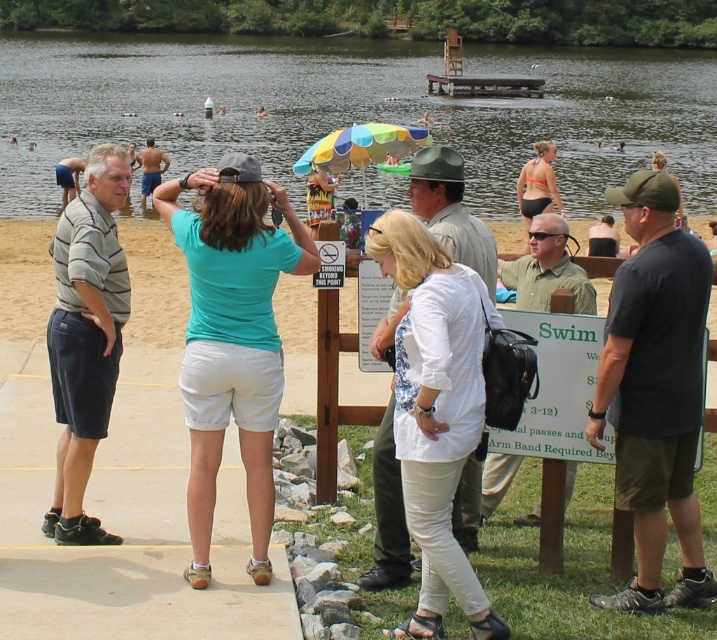
Question: Considering the real-world distances, which object is farthest from the clear water at center?

Choices:
 (A) matte blue shorts at center
 (B) striped polo shirt at center
 (C) teal fabric shirt at center

Answer: (C)

Question: Does teal fabric shirt at center have a greater width compared to striped polo shirt at center?

Choices:
 (A) yes
 (B) no

Answer: (B)

Question: Which point is farther to the camera?

Choices:
 (A) matte blue shorts at center
 (B) striped polo shirt at center
 (C) teal fabric shirt at center

Answer: (A)

Question: Does clear water at center appear on the left side of matte blue shorts at center?

Choices:
 (A) no
 (B) yes

Answer: (B)

Question: Does striped polo shirt at center appear over matte blue shorts at center?

Choices:
 (A) no
 (B) yes

Answer: (A)

Question: Based on their relative distances, which object is farther from the teal fabric shirt at center?

Choices:
 (A) clear water at center
 (B) matte blue shorts at center

Answer: (A)